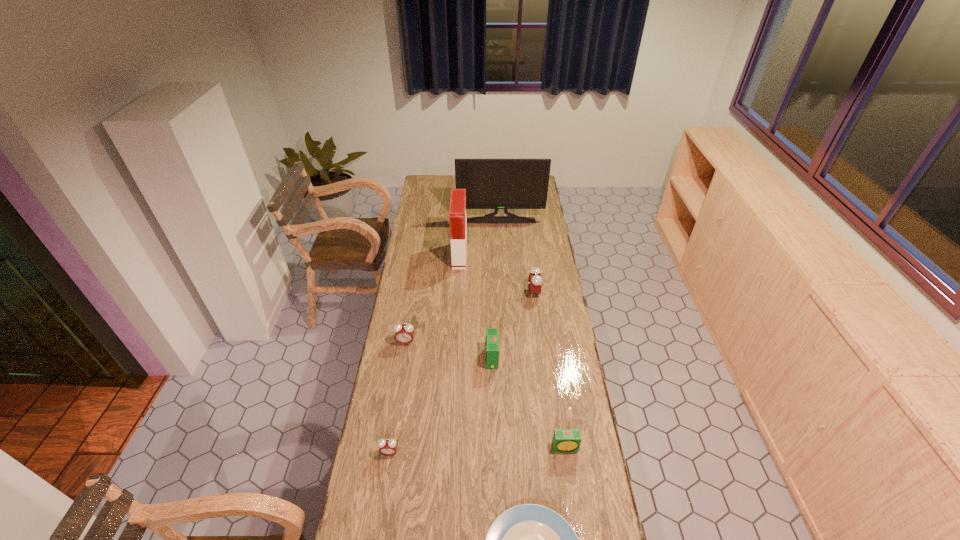
Locate an element on the screen. vacant area that lies between the monitor and the smallest pink alarm clock is located at coordinates (445, 337).

The width and height of the screenshot is (960, 540). I want to click on free spot between the nearest pink alarm clock and the farthest object, so click(x=445, y=337).

This screenshot has width=960, height=540. Identify the location of blank region between the biggest pink alarm clock and the farthest object. (517, 257).

The image size is (960, 540). I want to click on free spot between the smallest pink alarm clock and the second farthest pink alarm clock, so click(x=397, y=398).

I want to click on vacant point located between the nearest pink alarm clock and the cigarette_case, so click(x=424, y=354).

Identify which object is the third nearest to the farthest object. Please provide its 2D coordinates. Your answer should be formatted as a tuple, i.e. [(x, y)], where the tuple contains the x and y coordinates of a point satisfying the conditions above.

[(404, 334)]

Locate which object is the seventh closest to the nearer green alarm clock. Please provide its 2D coordinates. Your answer should be formatted as a tuple, i.e. [(x, y)], where the tuple contains the x and y coordinates of a point satisfying the conditions above.

[(496, 184)]

This screenshot has width=960, height=540. I want to click on alarm clock that is the second closest to the nearer green alarm clock, so click(x=388, y=447).

Choose which alarm clock is the fourth nearest neighbor to the seventh nearest object. Please provide its 2D coordinates. Your answer should be formatted as a tuple, i.e. [(x, y)], where the tuple contains the x and y coordinates of a point satisfying the conditions above.

[(388, 447)]

I want to click on the second closest pink alarm clock to the farthest object, so click(x=404, y=334).